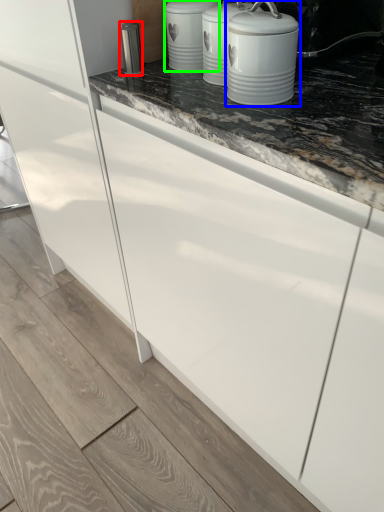
Question: Considering the real-world distances, which object is farthest from appliance (highlighted by a red box)? home appliance (highlighted by a blue box) or kitchen appliance (highlighted by a green box)?

Choices:
 (A) home appliance
 (B) kitchen appliance

Answer: (A)